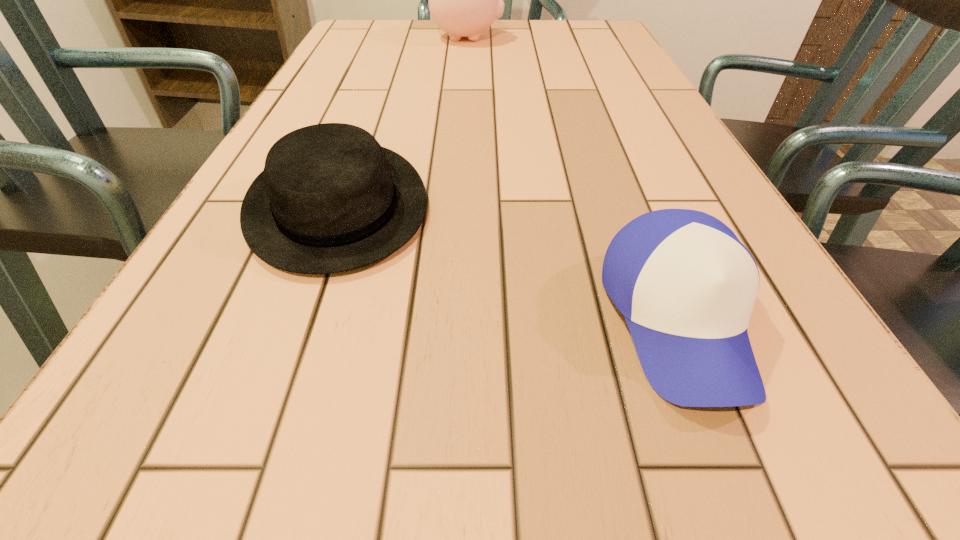
Locate an element on the screen. This screenshot has height=540, width=960. free region at the far edge of the desktop is located at coordinates (426, 44).

Find the location of a particular element. The height and width of the screenshot is (540, 960). free point at the near edge is located at coordinates (300, 539).

In the image, there is a desktop. Where is `vacant space at the left edge`? The height and width of the screenshot is (540, 960). vacant space at the left edge is located at coordinates (171, 477).

At what (x,y) coordinates should I click in order to perform the action: click on blank space at the right edge of the desktop. Please return your answer as a coordinate pair (x, y). The image size is (960, 540). Looking at the image, I should click on (576, 69).

Find the location of `free region at the far left corner`. free region at the far left corner is located at coordinates (349, 29).

Where is `free space at the far right corner of the desktop`? free space at the far right corner of the desktop is located at coordinates (595, 34).

The width and height of the screenshot is (960, 540). I want to click on empty space that is in between the farthest object and the fedora, so click(x=402, y=122).

You are a GUI agent. You are given a task and a screenshot of the screen. Output one action in this format:
    pyautogui.click(x=<x>, y=<y>)
    Task: Click on the vacant area between the rightmost object and the farthest object
    
    Given the screenshot: What is the action you would take?
    pyautogui.click(x=572, y=179)

Where is `free space that is in between the farthest object and the fedora`? free space that is in between the farthest object and the fedora is located at coordinates (402, 122).

This screenshot has height=540, width=960. I want to click on free space between the fedora and the baseball cap, so click(507, 262).